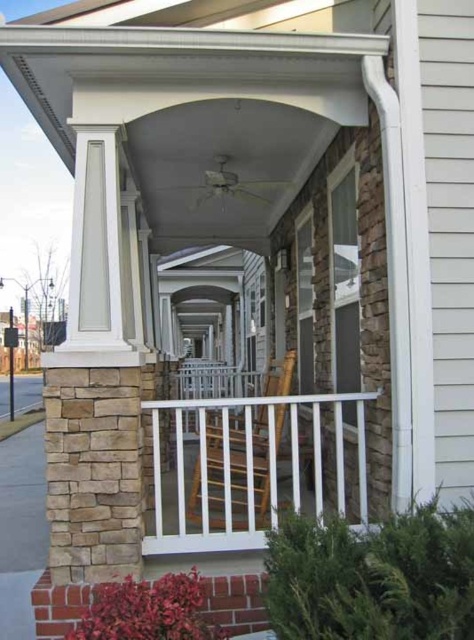
You are a delivery person trying to place a large package on the porch. The package is too big to fit through the doorway. You notice the white plastic balustrade at center and the wooden rocking chair at center. Which object should you move to make space for the package?

You should move the white plastic balustrade at center because it is larger in size than the wooden rocking chair at center, so moving it would free up more space.

You are a delivery person carrying a large package that is 12 inches wide. You need to place it between the white plastic balustrade at center and the wooden rocking chair at center on the porch. Is there enough space to fit the package between them?

The distance between the white plastic balustrade at center and the wooden rocking chair at center is 11.68 inches. Since the package is 12 inches wide, it is slightly wider than the available space, so it won not fit between them.

You are standing on the porch and want to move from the wooden rocking chair at center to the white plastic balustrade at center. Which direction should you move to get closer to the balustrade?

You should move forward towards the white plastic balustrade at center because it is closer to the viewer than the wooden rocking chair at center, so moving forward from the chair will bring you closer to the balustrade.